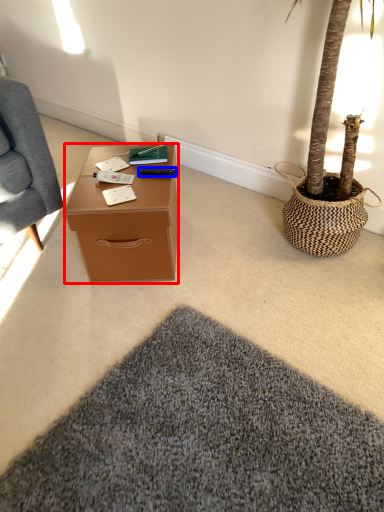
Question: Which of the following is the farthest to the observer, desk (highlighted by a red box) or remote control (highlighted by a blue box)?

Choices:
 (A) desk
 (B) remote control

Answer: (B)